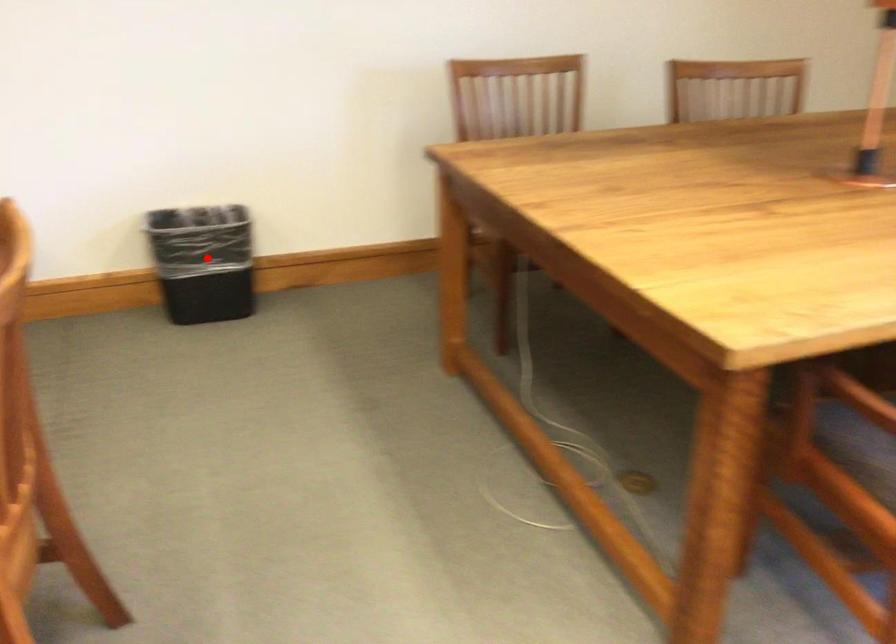
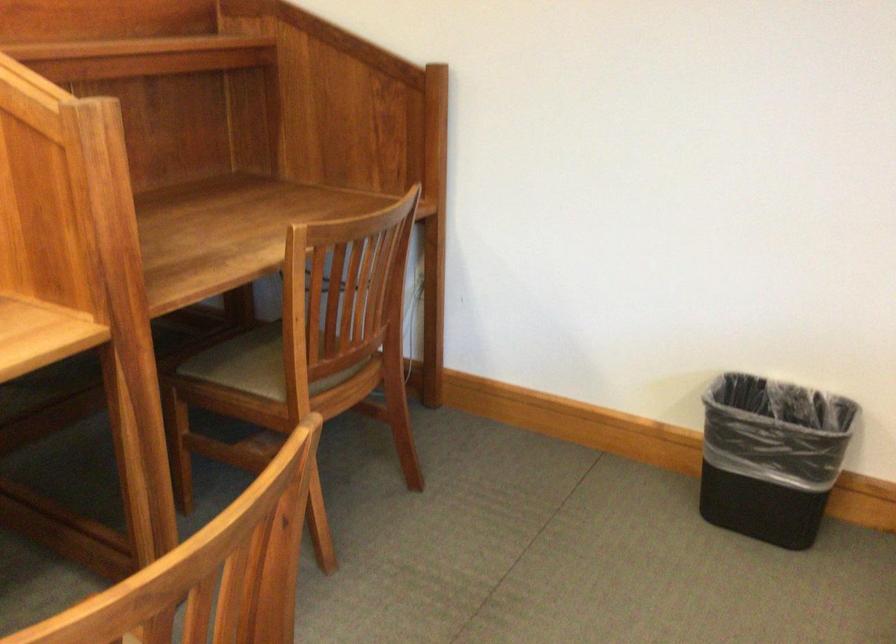
Question: I am providing you with two images of the same scene from different viewpoints. A red point is shown in image1. For the corresponding object point in image2, is it positioned nearer or farther from the camera?

Choices:
 (A) Nearer
 (B) Farther

Answer: (A)